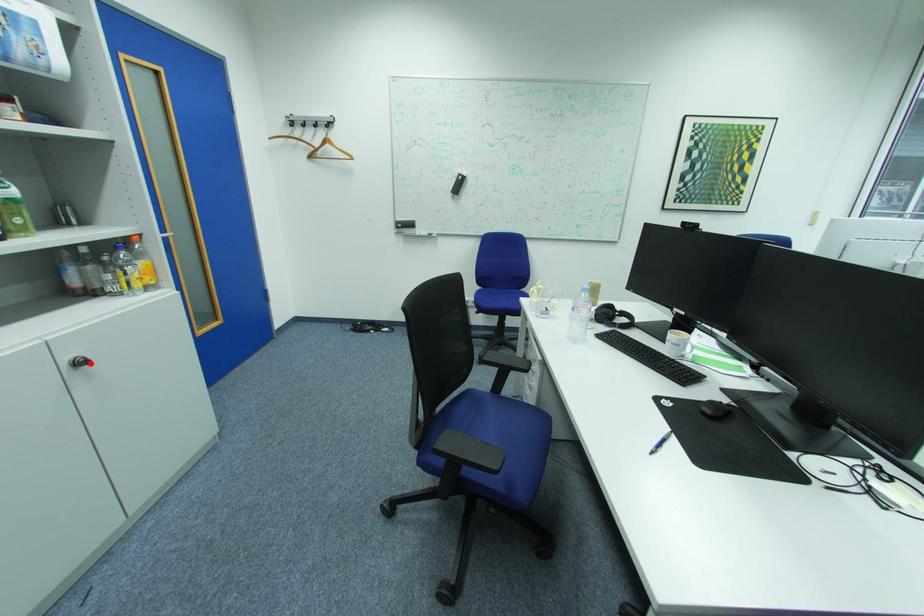
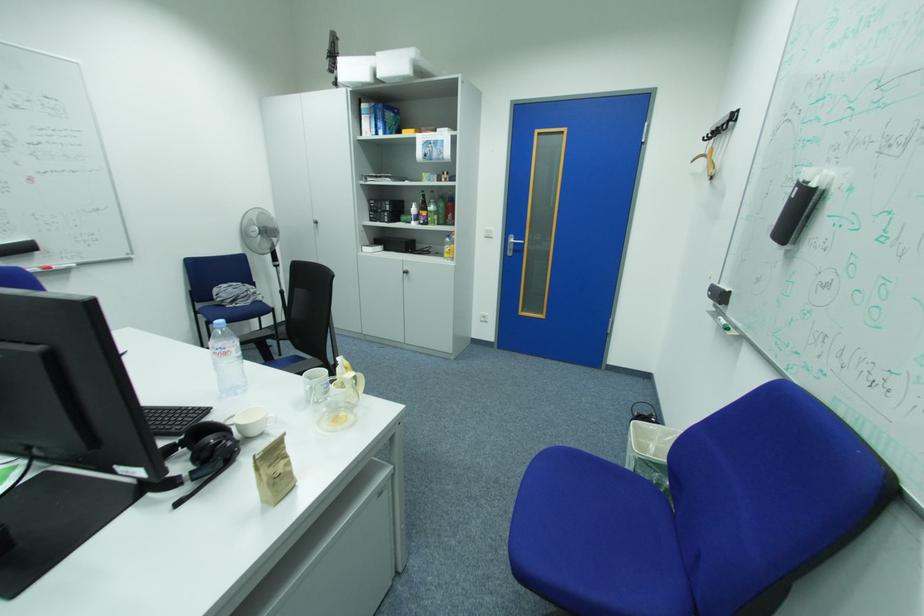
Question: I am providing you with two images of the same scene from different viewpoints. A red point is marked on the first image. Can you still see the location of the red point in image 2?

Choices:
 (A) Yes
 (B) No

Answer: (A)